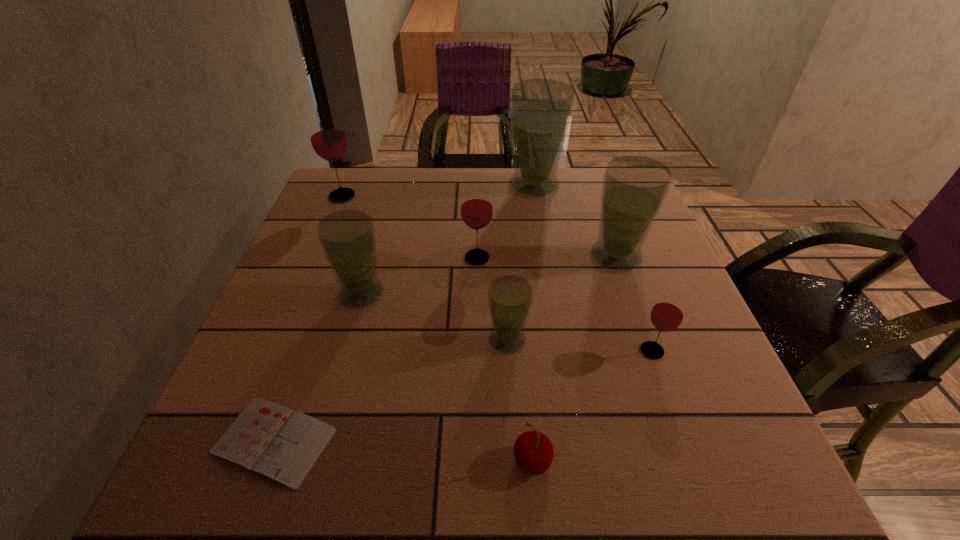
Image resolution: width=960 pixels, height=540 pixels. In order to click on free space located on the right of the fifth farthest object in this screenshot , I will do `click(433, 294)`.

The height and width of the screenshot is (540, 960). Identify the location of vacant space situated on the back of the nearest red glass. (612, 235).

Where is `vacant space positioned on the left of the nearest blue glass`? The width and height of the screenshot is (960, 540). vacant space positioned on the left of the nearest blue glass is located at coordinates (456, 340).

Where is `vacant space located 0.150m on the right of the eighth tallest object`? The width and height of the screenshot is (960, 540). vacant space located 0.150m on the right of the eighth tallest object is located at coordinates (650, 461).

Identify the location of free space located on the back of the shortest object. This screenshot has width=960, height=540. (327, 292).

Where is `cherry located in the near edge section of the desktop`? cherry located in the near edge section of the desktop is located at coordinates (533, 451).

You are a GUI agent. You are given a task and a screenshot of the screen. Output one action in this format:
    pyautogui.click(x=<x>, y=<y>)
    Task: Click on the diary that is at the near edge
    
    Given the screenshot: What is the action you would take?
    pyautogui.click(x=273, y=440)

Identify the location of diary that is positioned at the left edge. The height and width of the screenshot is (540, 960). (273, 440).

At what (x,y) coordinates should I click in order to perform the action: click on object that is at the far left corner. Please return your answer as a coordinate pair (x, y). Looking at the image, I should click on (327, 135).

Image resolution: width=960 pixels, height=540 pixels. Find the location of `object positioned at the near left corner`. object positioned at the near left corner is located at coordinates (273, 440).